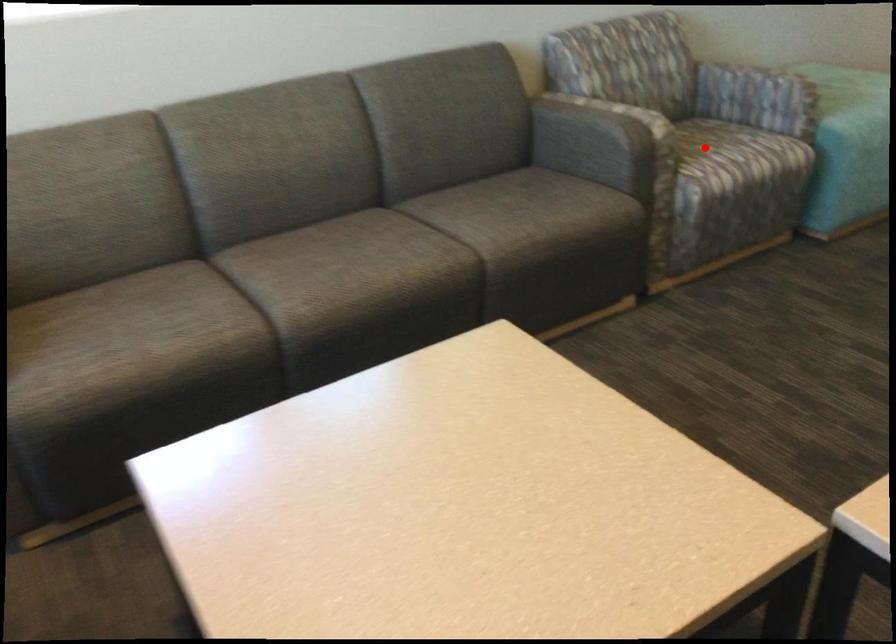
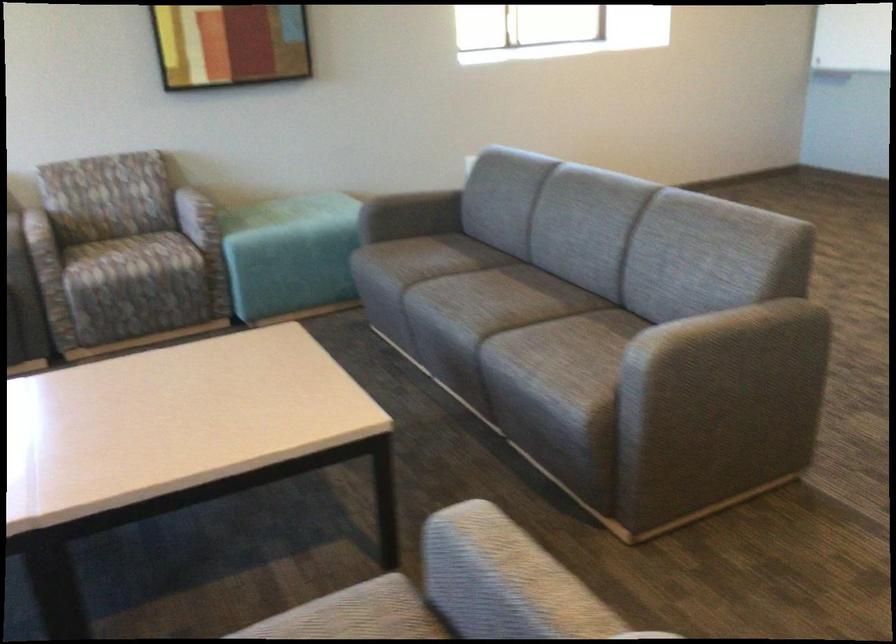
In the second image, find the point that corresponds to the highlighted location in the first image.

(125, 259)